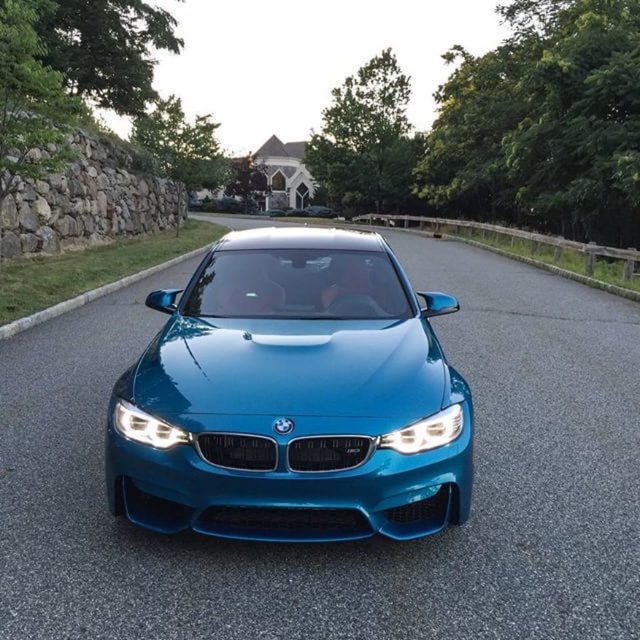
Question: Is glossy metallic car at center to the right of matte blue headlight at center from the viewer's perspective?

Choices:
 (A) yes
 (B) no

Answer: (A)

Question: Which of the following is the closest to the observer?

Choices:
 (A) (138, 412)
 (B) (272, 442)

Answer: (B)

Question: Which point is farther to the camera?

Choices:
 (A) (432, 429)
 (B) (200, 385)

Answer: (B)

Question: Based on their relative distances, which object is farther from the glossy metallic car at center?

Choices:
 (A) matte blue headlight at center
 (B) satin chrome headlight at center

Answer: (A)

Question: Is glossy metallic car at center further to camera compared to satin chrome headlight at center?

Choices:
 (A) yes
 (B) no

Answer: (B)

Question: Is satin chrome headlight at center positioned in front of matte blue headlight at center?

Choices:
 (A) no
 (B) yes

Answer: (A)